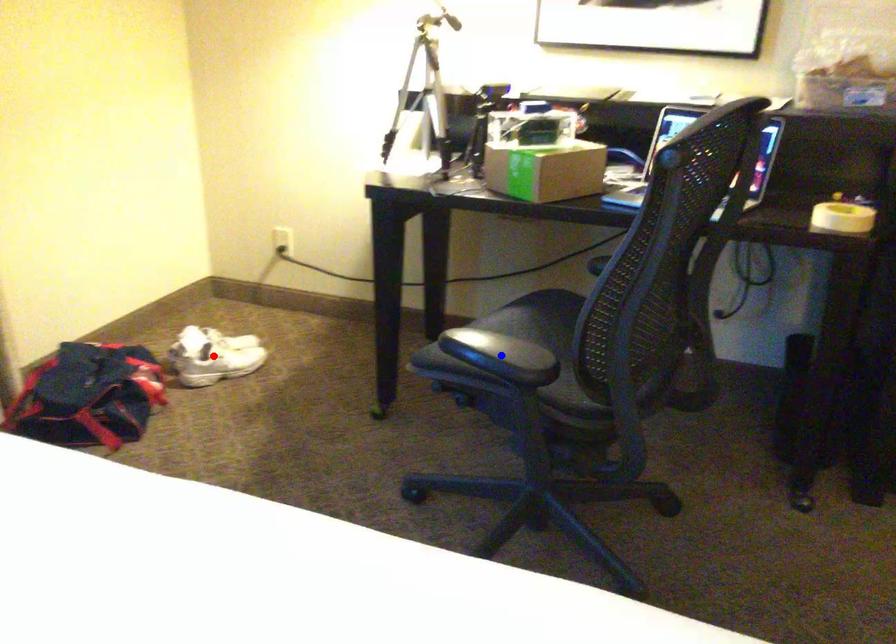
Question: Two points are marked on the image. Which point is closer to the camera?

Choices:
 (A) Blue point is closer.
 (B) Red point is closer.

Answer: (A)